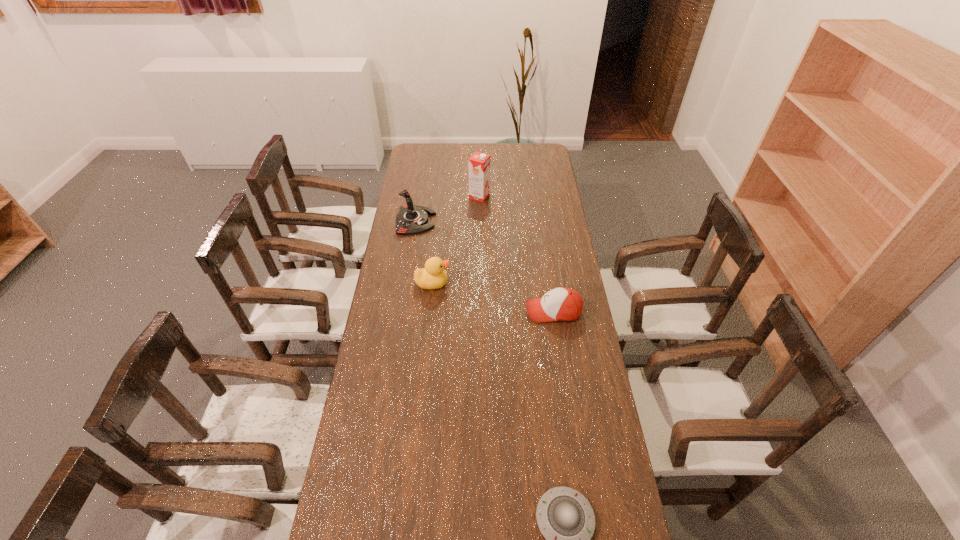
Where is `blank area located 0.320m at the beak of the third farthest object`? The image size is (960, 540). blank area located 0.320m at the beak of the third farthest object is located at coordinates (530, 283).

Locate an element on the screen. This screenshot has width=960, height=540. free point located 0.090m on the front-facing side of the baseball cap is located at coordinates (501, 311).

You are a GUI agent. You are given a task and a screenshot of the screen. Output one action in this format:
    pyautogui.click(x=<x>, y=<y>)
    Task: Click on the vacant space located on the front-facing side of the baseball cap
    The width and height of the screenshot is (960, 540).
    Given the screenshot: What is the action you would take?
    pyautogui.click(x=435, y=311)

Find the location of a particular element. This screenshot has width=960, height=540. free region located on the front-facing side of the baseball cap is located at coordinates (465, 311).

This screenshot has height=540, width=960. I want to click on joystick at the left edge, so click(x=412, y=219).

Where is `duck that is at the left edge`? duck that is at the left edge is located at coordinates (433, 276).

This screenshot has height=540, width=960. In order to click on object that is at the right edge in this screenshot , I will do `click(563, 304)`.

In the image, there is a desktop. Identify the location of vacant space at the left edge. (386, 424).

This screenshot has height=540, width=960. Find the location of `free space at the right edge of the desktop`. free space at the right edge of the desktop is located at coordinates (565, 343).

Locate an element on the screen. vacant region between the fourth shortest object and the second shortest object is located at coordinates (485, 266).